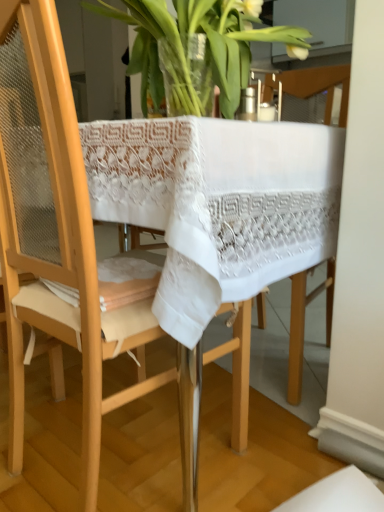
Locate an element on the screen. This screenshot has width=384, height=512. vacant space behind wooden chair at center is located at coordinates coord(134,382).